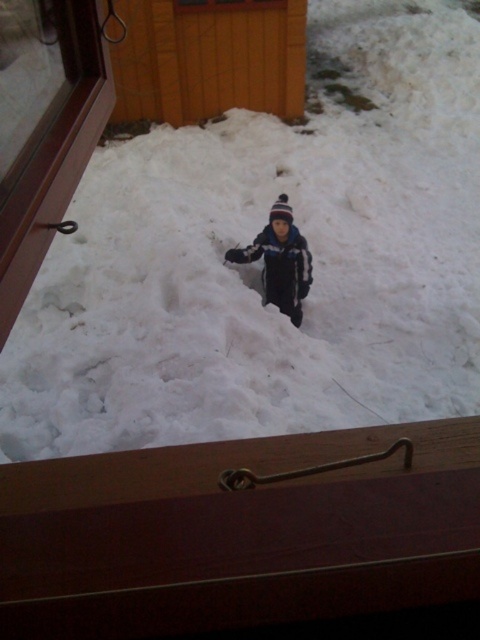
You are standing inside a building looking through the window. You see the white fluffy snow at center and the dark blue fleece jacket at center. How far apart are these two objects from each other?

The white fluffy snow at center is 4.57 feet from the dark blue fleece jacket at center.

You are looking through the window and see two points marked in the snowy scene. Based on their positions, which point is closer to you, the one at coordinates point (33, 385) or point (273, 248)?

Point (33, 385) is in front of point (273, 248), so it is closer to you.